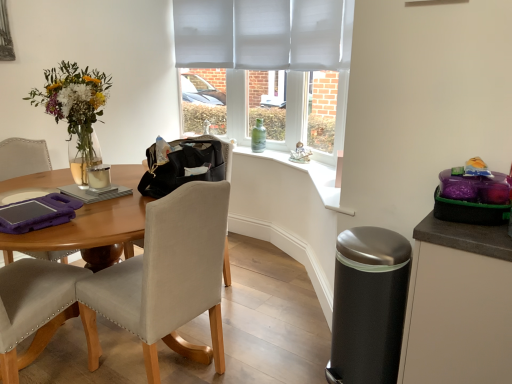
The image size is (512, 384). In order to click on vacant space situated on the left part of satin black trash can at lower right in this screenshot , I will do `click(296, 360)`.